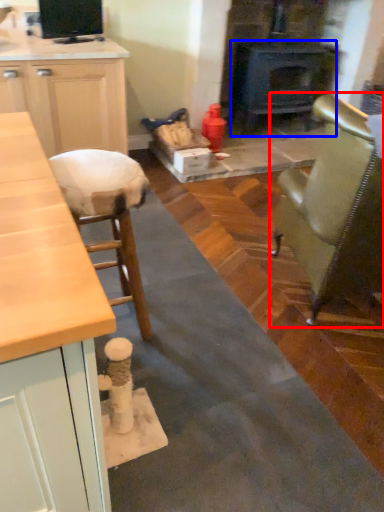
Question: Among these objects, which one is farthest to the camera, chair (highlighted by a red box) or wood burning stove (highlighted by a blue box)?

Choices:
 (A) chair
 (B) wood burning stove

Answer: (B)